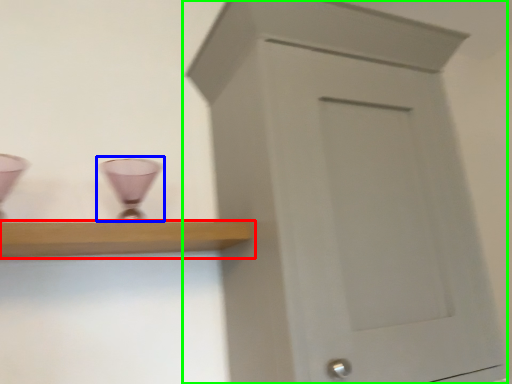
Question: Which object is positioned farthest from shelf (highlighted by a red box)? Select from candle holder (highlighted by a blue box) and cupboard (highlighted by a green box).

Choices:
 (A) candle holder
 (B) cupboard

Answer: (B)